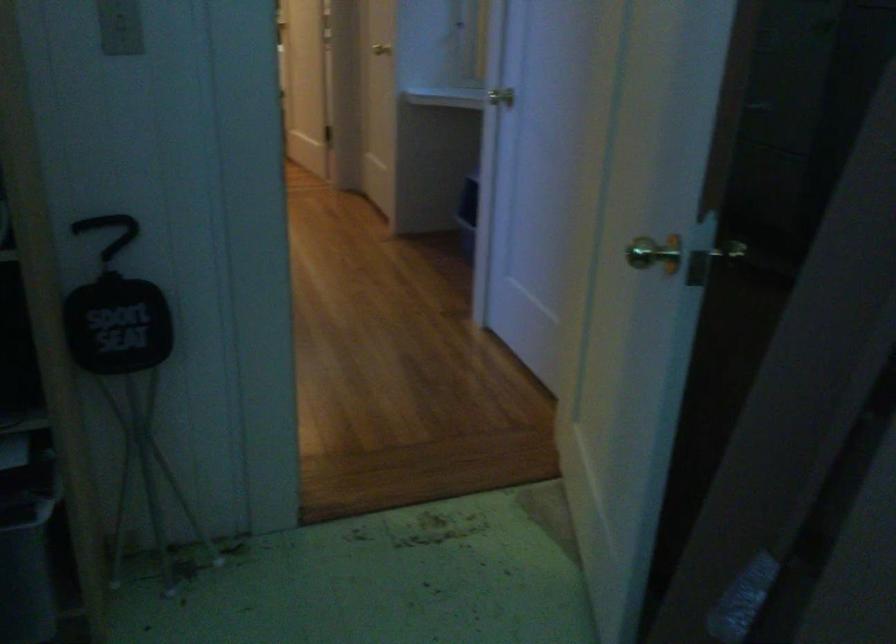
What do you see at coordinates (108, 232) in the screenshot?
I see `the seat handle` at bounding box center [108, 232].